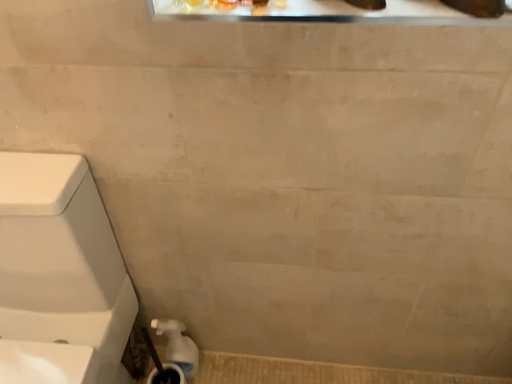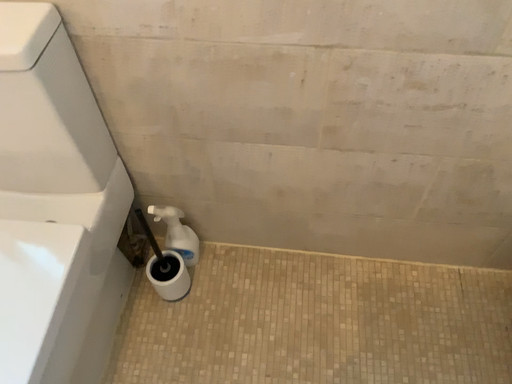
Question: Which way did the camera rotate in the video?

Choices:
 (A) rotated upward
 (B) rotated downward

Answer: (B)